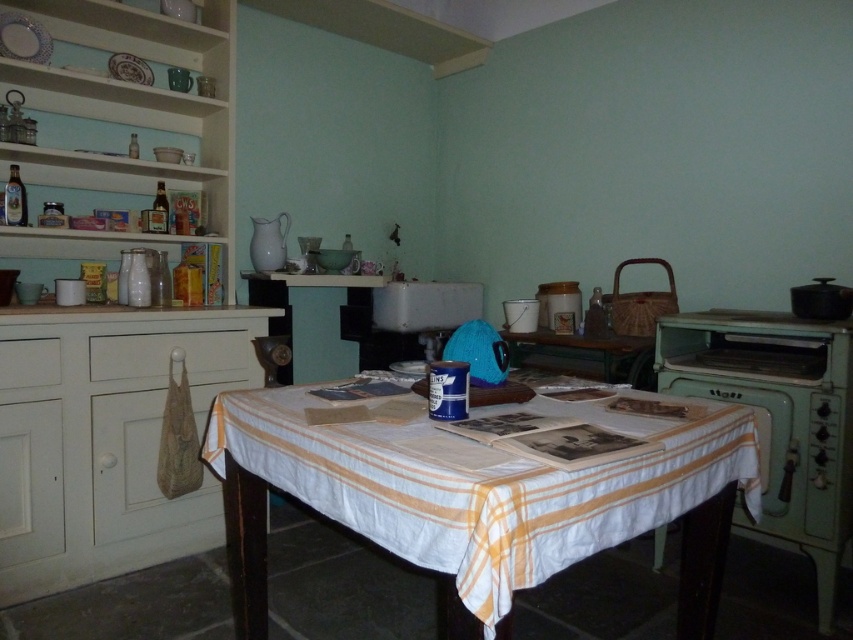
You are standing in the vintage kitchen and want to place a small decorative item on the table. There are two specific points on the table where you can place it. The first point is at coordinates point (x=805, y=484), and the second is at point (x=32, y=365). Which of these points is closer to you?

The point at coordinates point (x=805, y=484) is closer to you than the point at (x=32, y=365).

You are a chef preparing to place a large baking tray that is 1 meter wide. You have to choose between the space next to the green matte oven at right and the space next to the white wood drawer at left. Which space can accommodate the tray without it overlapping?

The green matte oven at right might be wider than white wood drawer at left, so the space next to the green matte oven at right is more likely to accommodate the 1 meter wide baking tray since it has more width available.

You are standing in the kitchen and need to reach both the green matte oven at right and the white wood drawer at left. Which one should you move towards first if you want to reach the one closest to you?

The white wood drawer at left is closer to you than the green matte oven at right, so you should move towards the white wood drawer at left first.